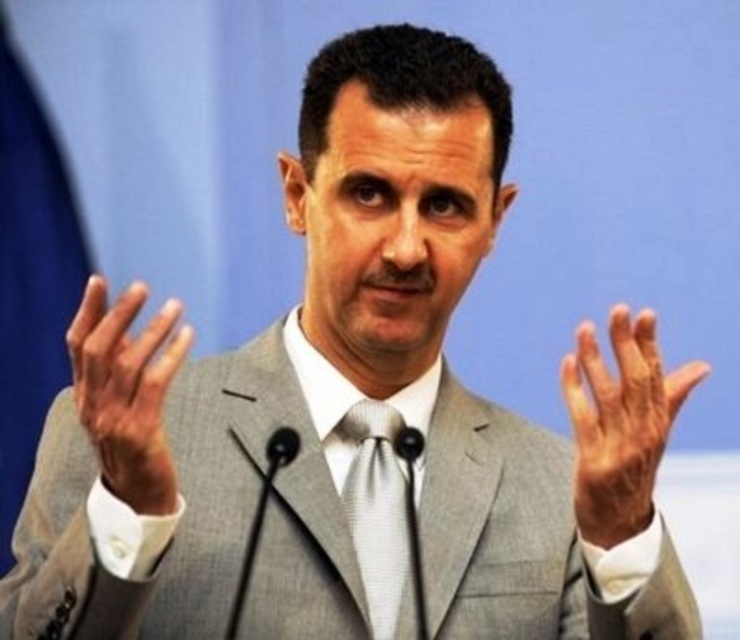
In the scene shown: You are a photographer at a press conference. You need to capture a closeup shot of the silver textured tie at center while ensuring the smooth skin hand at left is visible in the frame. Can you fit both in the vertical frame if the hand is shorter than the tie?

The smooth skin hand at left is shorter than the silver textured tie at center, so yes, both can fit within the vertical frame since the hand does not exceed the tie in height.

You are a photographer setting up for a formal event. You need to ensure that the smooth skin hand at left and the silver textured tie at center are both in focus. Given that your camera can only focus on objects within a 15 inch range, will both objects be in focus?

The smooth skin hand at left is 17.44 inches from the silver textured tie at center. Since the distance between them exceeds the camera focus range of 15 inches, the camera cannot keep both in focus simultaneously.